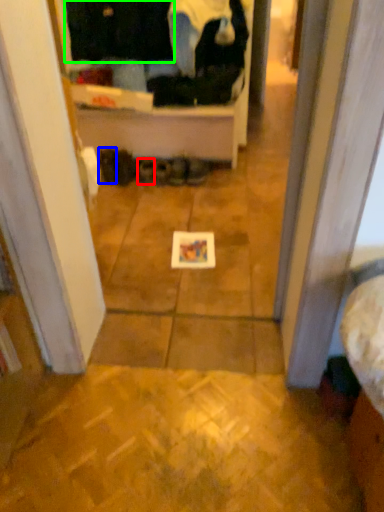
Question: Which object is the farthest from footwear (highlighted by a red box)? Choose among these: footwear (highlighted by a blue box) or clothing (highlighted by a green box).

Choices:
 (A) footwear
 (B) clothing

Answer: (B)